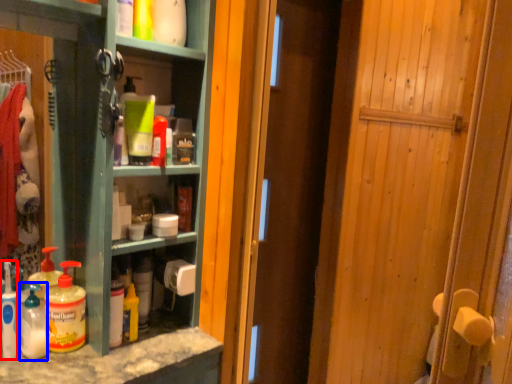
Question: Which object is further to the camera taking this photo, cleaning product (highlighted by a red box) or cleaning product (highlighted by a blue box)?

Choices:
 (A) cleaning product
 (B) cleaning product

Answer: (B)